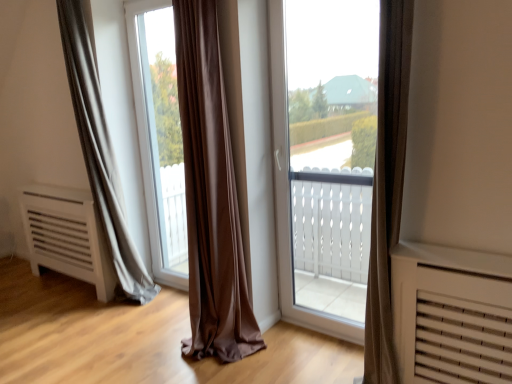
Question: From the image's perspective, would you say matte gray curtain at left is positioned over transparent glass window at center?

Choices:
 (A) yes
 (B) no

Answer: (A)

Question: Is matte gray curtain at left to the right of transparent glass window at center from the viewer's perspective?

Choices:
 (A) no
 (B) yes

Answer: (A)

Question: Is matte gray curtain at left not inside transparent glass window at center?

Choices:
 (A) no
 (B) yes

Answer: (B)

Question: Is matte gray curtain at left facing towards transparent glass window at center?

Choices:
 (A) yes
 (B) no

Answer: (B)

Question: Is matte gray curtain at left bigger than transparent glass window at center?

Choices:
 (A) no
 (B) yes

Answer: (B)

Question: In terms of size, does matte gray curtain at left appear bigger or smaller than transparent glass window at center?

Choices:
 (A) big
 (B) small

Answer: (A)

Question: From a real-world perspective, is matte gray curtain at left physically located above or below transparent glass window at center?

Choices:
 (A) above
 (B) below

Answer: (A)

Question: Considering the positions of point (96, 122) and point (177, 193), is point (96, 122) closer or farther from the camera than point (177, 193)?

Choices:
 (A) farther
 (B) closer

Answer: (B)

Question: Looking at their shapes, would you say matte gray curtain at left is wider or thinner than transparent glass window at center?

Choices:
 (A) wide
 (B) thin

Answer: (A)

Question: From a real-world perspective, is matte gray curtain at left physically located above or below transparent glass window at center?

Choices:
 (A) below
 (B) above

Answer: (B)

Question: Considering the positions of matte gray curtain at left and transparent glass window at center in the image, is matte gray curtain at left bigger or smaller than transparent glass window at center?

Choices:
 (A) big
 (B) small

Answer: (A)

Question: In terms of width, does matte gray curtain at left look wider or thinner when compared to transparent glass window at center?

Choices:
 (A) wide
 (B) thin

Answer: (A)

Question: Is matte gray curtain at left inside the boundaries of transparent glass window at center, or outside?

Choices:
 (A) outside
 (B) inside

Answer: (A)

Question: In the image, is transparent glass window at center on the left side or the right side of matte gray curtain at left?

Choices:
 (A) left
 (B) right

Answer: (B)

Question: Is transparent glass window at center taller or shorter than matte gray curtain at left?

Choices:
 (A) short
 (B) tall

Answer: (A)